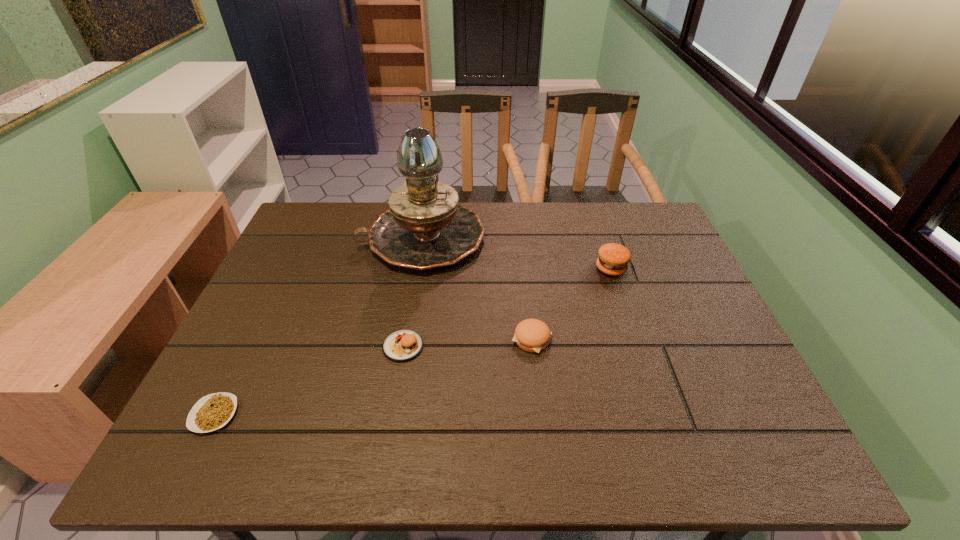
This screenshot has height=540, width=960. I want to click on vacant point located between the second patty from right to left and the tallest patty, so click(x=571, y=304).

This screenshot has width=960, height=540. I want to click on free space that is in between the second tallest object and the fourth object from left to right, so click(571, 304).

At what (x,y) coordinates should I click in order to perform the action: click on vacant space that's between the tallest object and the leftmost object. Please return your answer as a coordinate pair (x, y). This screenshot has width=960, height=540. Looking at the image, I should click on (318, 326).

Identify which object is located as the fourth nearest to the leftmost patty. Please provide its 2D coordinates. Your answer should be formatted as a tuple, i.e. [(x, y)], where the tuple contains the x and y coordinates of a point satisfying the conditions above.

[(613, 259)]

Identify the location of object that stands as the closest to the shortest object. This screenshot has height=540, width=960. (402, 345).

The height and width of the screenshot is (540, 960). I want to click on the third closest patty to the nearest object, so click(613, 259).

In order to click on the closest patty to the second shortest object in this screenshot , I will do `click(402, 345)`.

The width and height of the screenshot is (960, 540). I want to click on vacant position in the image that satisfies the following two spatial constraints: 1. on the back side of the leftmost patty; 2. on the right side of the second tallest object, so click(416, 268).

The height and width of the screenshot is (540, 960). What are the coordinates of `vacant area that satisfies the following two spatial constraints: 1. on the back side of the second patty from right to left; 2. on the left side of the leftmost patty` in the screenshot? It's located at (404, 340).

Image resolution: width=960 pixels, height=540 pixels. What are the coordinates of `vacant region that satisfies the following two spatial constraints: 1. on the front side of the tallest patty; 2. on the right side of the tallest object` in the screenshot? It's located at (418, 268).